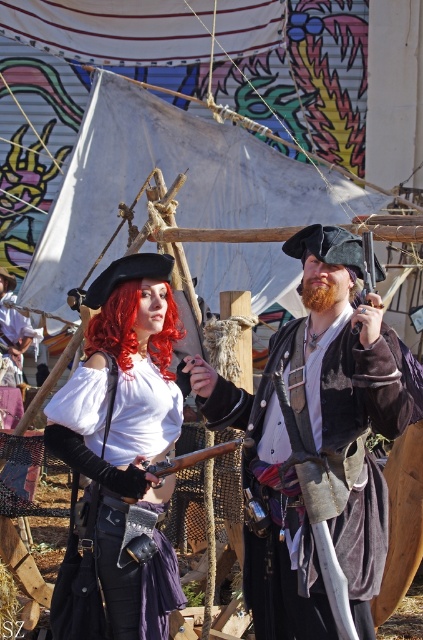
You are a pirate judge at a costume contest. You need to determine which sword is placed lower between the brown leather sword at center and the wooden sword at center. Which one is lower?

The brown leather sword at center is located below the wooden sword at center, so the brown leather sword at center is lower.

You are standing in the historical event setting and want to reach the point marked at coordinates (180, 470). If you can walk 100 feet per minute, how many minutes will it take you to reach that point?

The point at (180, 470) is 110.90 feet away from the viewer. At a walking speed of 100 feet per minute, it would take approximately 1.11 minutes to reach the point.

You are a photographer trying to capture a closeup shot of the pirate with the red beard. You have two points marked in the image to focus on. The first point is at coordinates point (364, 308) and the second point is at coordinates point (367, 266). Which of these two points should you focus on to get the best closeup of the pirate with the red beard?

Point (364, 308) is closer to the viewer than point (367, 266). Therefore, focusing on point (364, 308) will provide a better closeup of the pirate with the red beard since it is nearer to the viewer.